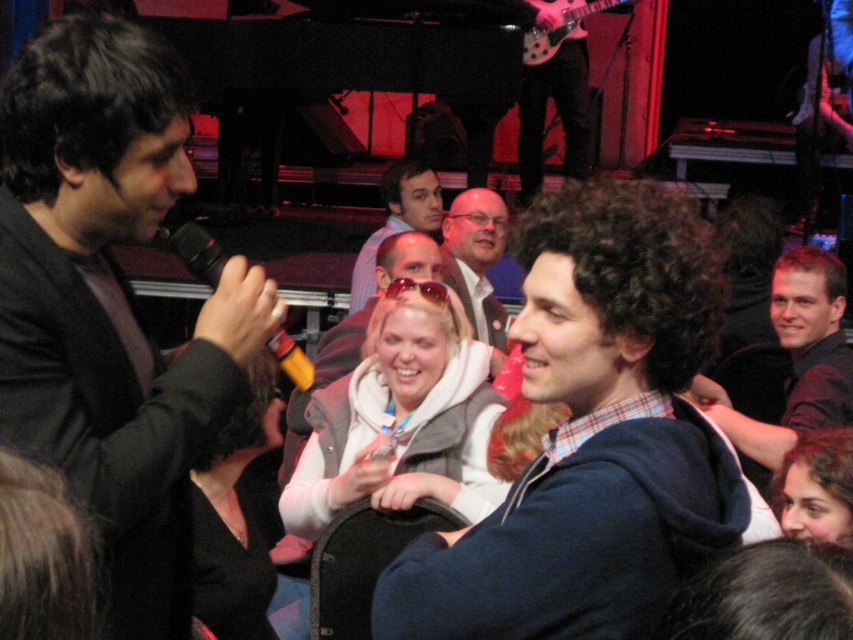
Does point (142, 193) lie in front of point (480, 211)?

That is True.

Is point (154, 92) positioned before point (476, 195)?

Yes.

What are the coordinates of `black matte jacket at left` in the screenshot? It's located at (111, 301).

Can you confirm if dark brown hair at right is positioned above orange matte microphone at left?

Actually, dark brown hair at right is below orange matte microphone at left.

Can you confirm if dark brown hair at right is taller than orange matte microphone at left?

Indeed, dark brown hair at right has a greater height compared to orange matte microphone at left.

Where is `dark brown hair at right`? dark brown hair at right is located at coordinates (799, 356).

Between point (831, 540) and point (170, 234), which one is positioned behind?

The point (831, 540) is behind.

In the scene shown: Does smooth brown hair at lower right lie behind orange matte microphone at left?

Yes, it is.

Is point (842, 452) farther from camera compared to point (167, 237)?

Yes, it is behind point (167, 237).

Locate an element on the screen. The image size is (853, 640). smooth brown hair at lower right is located at coordinates (817, 486).